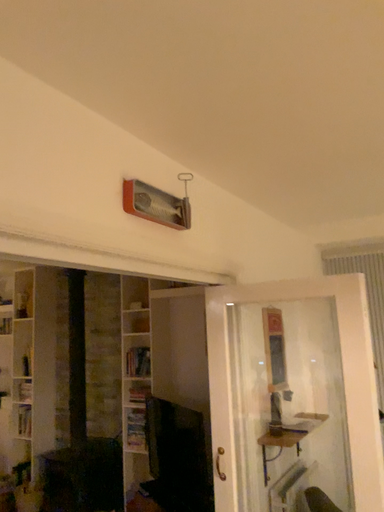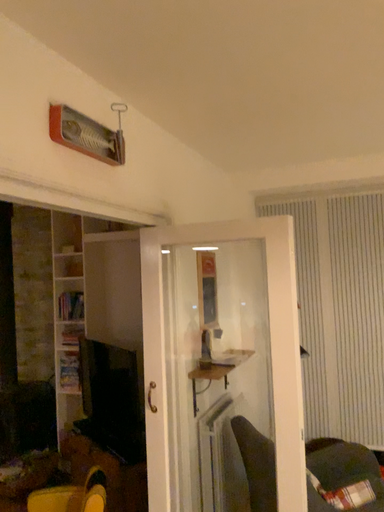
Question: How did the camera likely rotate when shooting the video?

Choices:
 (A) rotated left
 (B) rotated right

Answer: (B)